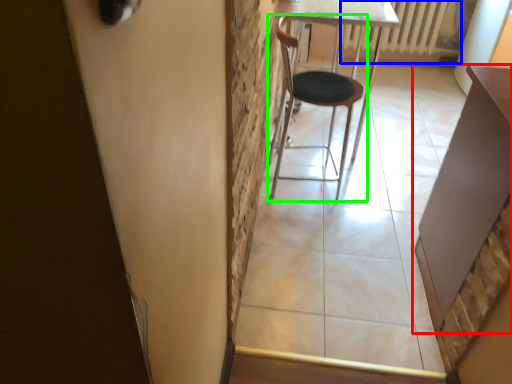
Question: Estimate the real-world distances between objects in this image. Which object is closer to table (highlighted by a red box), radiator (highlighted by a blue box) or chair (highlighted by a green box)?

Choices:
 (A) radiator
 (B) chair

Answer: (B)